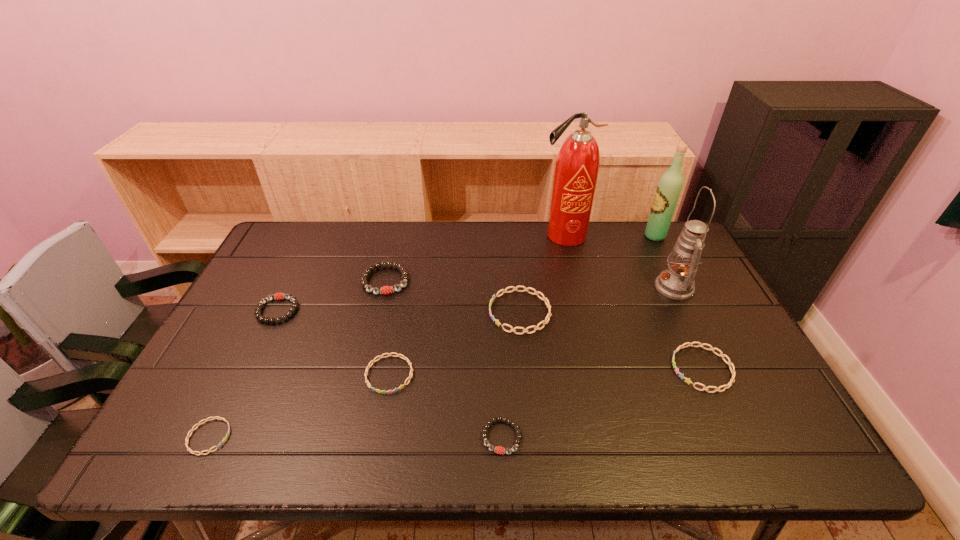
At what (x,y) coordinates should I click in order to perform the action: click on the second smallest blue bracelet. Please return your answer as a coordinate pair (x, y). The image size is (960, 540). Looking at the image, I should click on (389, 354).

You are a GUI agent. You are given a task and a screenshot of the screen. Output one action in this format:
    pyautogui.click(x=<x>, y=<y>)
    Task: Click on the smallest black bracelet
    The width and height of the screenshot is (960, 540).
    Given the screenshot: What is the action you would take?
    pyautogui.click(x=499, y=450)

Locate an element on the screen. This screenshot has width=960, height=540. the nearest black bracelet is located at coordinates (499, 450).

The image size is (960, 540). In order to click on the smallest blue bracelet in this screenshot , I will do `click(218, 418)`.

I want to click on the leftmost blue bracelet, so click(x=218, y=418).

The width and height of the screenshot is (960, 540). I want to click on vacant space situated on the right of the tallest object, so click(621, 235).

Where is `vacant space located on the front-facing side of the white wine bottle`? The image size is (960, 540). vacant space located on the front-facing side of the white wine bottle is located at coordinates (607, 236).

Find the location of a particular element. Image resolution: width=960 pixels, height=540 pixels. vacant space positioned on the front-facing side of the white wine bottle is located at coordinates (576, 236).

Locate an element on the screen. The width and height of the screenshot is (960, 540). free spot located 0.060m on the front-facing side of the white wine bottle is located at coordinates (627, 236).

Where is `free space located on the front of the oil lamp`? The width and height of the screenshot is (960, 540). free space located on the front of the oil lamp is located at coordinates (712, 365).